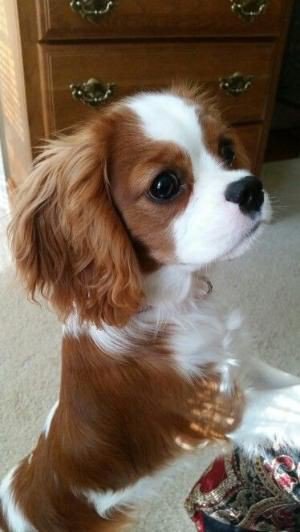
Identify the location of drawer handles. The width and height of the screenshot is (300, 532). pos(95,9), pos(254,14), pos(241,86), pos(101,96).